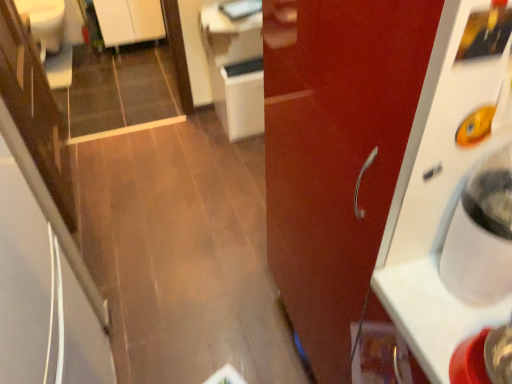
What do you see at coordinates (129, 21) in the screenshot? I see `white glossy cabinet at upper left, which is the 2th cabinetry from right to left` at bounding box center [129, 21].

Measure the distance between white glossy counter top at upper center and camera.

A distance of 6.89 feet exists between white glossy counter top at upper center and camera.

Measure the distance between point (x=234, y=96) and camera.

A distance of 2.31 meters exists between point (x=234, y=96) and camera.

Identify the location of white plastic water cooler at right. (481, 234).

At what (x,y) coordinates should I click in order to perform the action: click on water cooler in front of the glossy wood door at right. Please return your answer as a coordinate pair (x, y). Looking at the image, I should click on (481, 234).

Considering the points (282, 191) and (497, 224), which point is behind, point (282, 191) or point (497, 224)?

The point (282, 191) is more distant.

From the picture: Is glossy wood door at right further to the viewer compared to white plastic water cooler at right?

Yes, glossy wood door at right is behind white plastic water cooler at right.

Which object is further away from the camera, white plastic water cooler at right or glossy wood door at right?

glossy wood door at right.

Can you confirm if white plastic water cooler at right is wider than glossy wood door at right?

No.

Is white plastic water cooler at right smaller than glossy wood door at right?

Correct, white plastic water cooler at right occupies less space than glossy wood door at right.

From the picture: From a real-world perspective, is white plastic water cooler at right above or below glossy wood door at right?

white plastic water cooler at right is above glossy wood door at right.

Is white glossy counter top at upper center placed right next to white glossy cabinet at upper left, which is the second cabinetry from front to back?

There is a gap between white glossy counter top at upper center and white glossy cabinet at upper left, which is the second cabinetry from front to back.

Looking at their sizes, would you say white glossy counter top at upper center is wider or thinner than white glossy cabinet at upper left, which is the 2th cabinetry from right to left?

white glossy counter top at upper center is wider than white glossy cabinet at upper left, which is the 2th cabinetry from right to left.

Is white glossy counter top at upper center in front of or behind white glossy cabinet at upper left, which ranks as the 1th cabinetry in left-to-right order, in the image?

white glossy counter top at upper center is in front of white glossy cabinet at upper left, which ranks as the 1th cabinetry in left-to-right order.

In the scene shown: From a real-world perspective, who is located lower, white glossy counter top at upper center or white glossy cabinet at upper left, marked as the 1th cabinetry in a back-to-front arrangement?

white glossy cabinet at upper left, marked as the 1th cabinetry in a back-to-front arrangement, from a real-world perspective.

In terms of width, does white glossy counter top at upper center look wider or thinner when compared to white plastic water cooler at right?

Clearly, white glossy counter top at upper center has more width compared to white plastic water cooler at right.

In the scene shown: Can you confirm if white glossy counter top at upper center is shorter than white plastic water cooler at right?

Yes.

How many degrees apart are the facing directions of white glossy counter top at upper center and white plastic water cooler at right?

They differ by 90.1 degrees in their facing directions.

From a real-world perspective, is white glossy counter top at upper center positioned under white plastic water cooler at right based on gravity?

Yes, from a real-world perspective, white glossy counter top at upper center is below white plastic water cooler at right.

Can you confirm if white glossy cabinet at upper left, which ranks as the 1th cabinetry in left-to-right order, is bigger than glossy wood door at right?

Incorrect, white glossy cabinet at upper left, which ranks as the 1th cabinetry in left-to-right order, is not larger than glossy wood door at right.

Can you tell me how much white glossy cabinet at upper left, which is the first cabinetry in top-to-bottom order, and glossy wood door at right differ in facing direction?

0.369 degrees.

Is white glossy cabinet at upper left, marked as the 1th cabinetry in a back-to-front arrangement, beside glossy wood door at right?

white glossy cabinet at upper left, marked as the 1th cabinetry in a back-to-front arrangement, and glossy wood door at right are clearly separated.

Relative to glossy wood door at right, is white glossy cabinet at upper left, which ranks as the 1th cabinetry in left-to-right order, in front or behind?

Visually, white glossy cabinet at upper left, which ranks as the 1th cabinetry in left-to-right order, is located behind glossy wood door at right.

Is white glossy counter top at upper center not within glossy wood door at right?

Yes.

From the image's perspective, is white glossy counter top at upper center over glossy wood door at right?

Indeed, from the image's perspective, white glossy counter top at upper center is shown above glossy wood door at right.

Does white glossy counter top at upper center have a smaller size compared to glossy wood door at right?

Yes.

Does white glossy counter top at upper center have a lesser width compared to glossy wood door at right?

Correct, the width of white glossy counter top at upper center is less than that of glossy wood door at right.

Considering the relative sizes of white glossy cabinet at center, which appears as the second cabinetry when viewed from the left, and white plastic water cooler at right in the image provided, is white glossy cabinet at center, which appears as the second cabinetry when viewed from the left, taller than white plastic water cooler at right?

Yes.

Based on the photo, is white glossy cabinet at center, which is the 1th cabinetry in right-to-left order, next to white plastic water cooler at right and touching it?

No, white glossy cabinet at center, which is the 1th cabinetry in right-to-left order, is not in contact with white plastic water cooler at right.

What's the angular difference between white glossy cabinet at center, which appears as the second cabinetry when viewed from the left, and white plastic water cooler at right's facing directions?

white glossy cabinet at center, which appears as the second cabinetry when viewed from the left, and white plastic water cooler at right are facing 90.1 degrees away from each other.

Who is smaller, white glossy cabinet at center, which appears as the second cabinetry when viewed from the left, or white plastic water cooler at right?

white plastic water cooler at right is smaller.

The height and width of the screenshot is (384, 512). I want to click on water cooler that is on the right side of glossy wood door at right, so click(481, 234).

I want to click on water cooler that is in front of the glossy wood door at right, so click(481, 234).

Looking at the image, which one is located closer to white plastic water cooler at right, glossy wood door at right or white glossy cabinet at upper left, which ranks as the 1th cabinetry in left-to-right order?

The object closer to white plastic water cooler at right is glossy wood door at right.

Based on their spatial positions, is white glossy cabinet at upper left, positioned as the second cabinetry in bottom-to-top order, or glossy wood door at right further from white glossy counter top at upper center?

glossy wood door at right lies further to white glossy counter top at upper center than the other object.

Looking at the image, which one is located further to white plastic water cooler at right, glossy wood door at right or white glossy counter top at upper center?

white glossy counter top at upper center is positioned further to the anchor white plastic water cooler at right.

Estimate the real-world distances between objects in this image. Which object is closer to glossy wood door at right, white glossy counter top at upper center or white plastic water cooler at right?

A: white plastic water cooler at right is closer to glossy wood door at right.

Based on their spatial positions, is glossy wood door at right or white glossy cabinet at upper left, which is the 2th cabinetry from right to left, further from white glossy counter top at upper center?

glossy wood door at right is further to white glossy counter top at upper center.

Estimate the real-world distances between objects in this image. Which object is further from white glossy cabinet at upper left, which is the second cabinetry from front to back, white glossy cabinet at center, positioned as the first cabinetry in front-to-back order, or white glossy counter top at upper center?

The object further to white glossy cabinet at upper left, which is the second cabinetry from front to back, is white glossy counter top at upper center.

Based on their spatial positions, is white glossy cabinet at upper left, which is the 2th cabinetry from right to left, or white plastic water cooler at right closer to white glossy counter top at upper center?

white glossy cabinet at upper left, which is the 2th cabinetry from right to left, is closer to white glossy counter top at upper center.

When comparing their distances from white glossy counter top at upper center, does white glossy cabinet at center, which appears as the second cabinetry when viewed from the left, or white glossy cabinet at upper left, which is the second cabinetry from front to back, seem closer?

white glossy cabinet at center, which appears as the second cabinetry when viewed from the left, lies closer to white glossy counter top at upper center than the other object.

You are a GUI agent. You are given a task and a screenshot of the screen. Output one action in this format:
    pyautogui.click(x=<x>, y=<y>)
    Task: Click on the counter top between glossy wood door at right and white glossy cabinet at upper left, which is the first cabinetry in top-to-bottom order, in the front-back direction
    The image size is (512, 384).
    Given the screenshot: What is the action you would take?
    pyautogui.click(x=227, y=21)

The height and width of the screenshot is (384, 512). What are the coordinates of `cabinetry positioned between glossy wood door at right and white glossy cabinet at upper left, marked as the 1th cabinetry in a back-to-front arrangement, from near to far` in the screenshot? It's located at tap(234, 70).

Identify the location of door positioned between white plastic water cooler at right and white glossy counter top at upper center from near to far. This screenshot has width=512, height=384. (336, 155).

At what (x,y) coordinates should I click in order to perform the action: click on door between white plastic water cooler at right and white glossy cabinet at center, arranged as the second cabinetry when viewed from the top, from front to back. Please return your answer as a coordinate pair (x, y). Looking at the image, I should click on (336, 155).